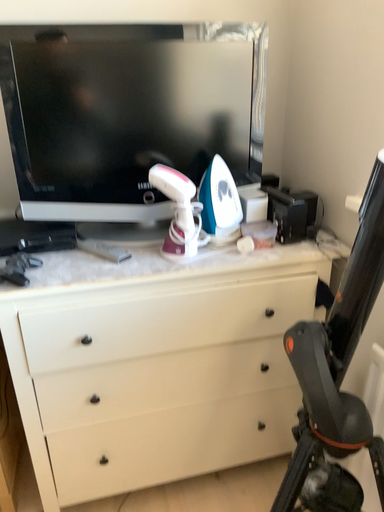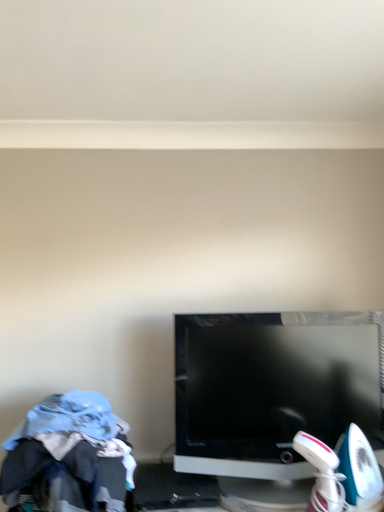
Question: How did the camera likely rotate when shooting the video?

Choices:
 (A) rotated upward
 (B) rotated downward

Answer: (A)